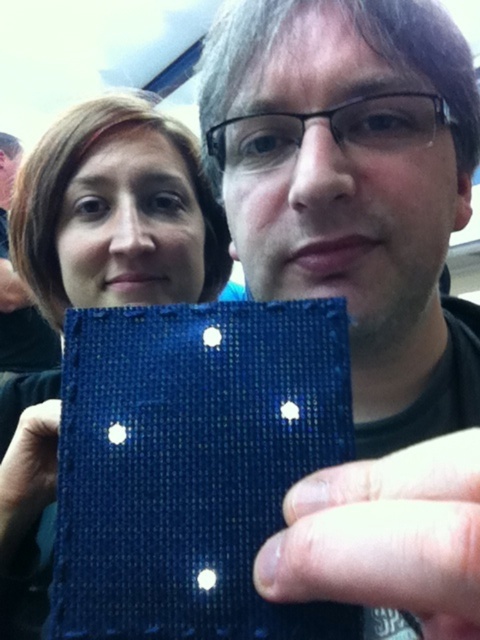
Is point (144, 140) closer to camera compared to point (420, 474)?

That is False.

The image size is (480, 640). Find the location of `matte blue fabric at center`. matte blue fabric at center is located at coordinates (117, 212).

What are the coordinates of `matte blue fabric at center` in the screenshot? It's located at (117, 212).